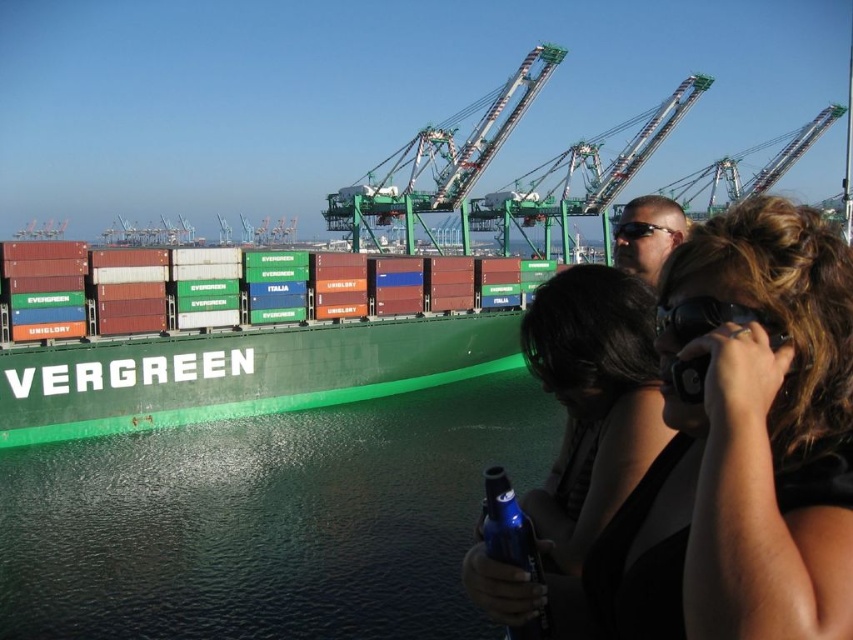
Question: Can you confirm if blue glass bottle at lower center is positioned to the right of matte black sunglasses at upper center?

Choices:
 (A) yes
 (B) no

Answer: (B)

Question: Considering the real-world distances, which object is closest to the green glossy water at lower center?

Choices:
 (A) matte black sunglasses at upper center
 (B) matte black hair at center

Answer: (B)

Question: Is green glossy water at lower center thinner than blue glass bottle at lower center?

Choices:
 (A) no
 (B) yes

Answer: (A)

Question: Which object is closer to the camera taking this photo?

Choices:
 (A) blue glass bottle at lower center
 (B) green glossy water at lower center
 (C) matte black sunglasses at center

Answer: (C)

Question: Does blue glass bottle at lower center appear on the left side of matte black sunglasses at upper center?

Choices:
 (A) no
 (B) yes

Answer: (B)

Question: Which object is farther from the camera taking this photo?

Choices:
 (A) blue glass bottle at lower center
 (B) green glossy water at lower center
 (C) matte black sunglasses at center
 (D) matte black hair at center

Answer: (B)